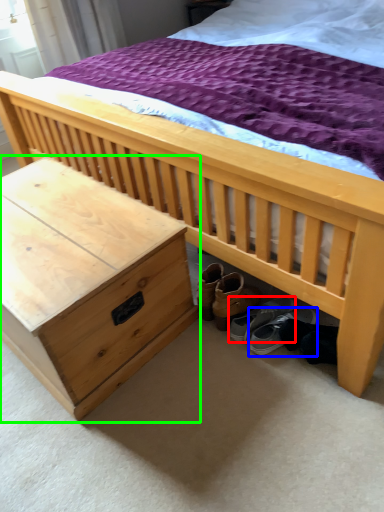
Question: Which is farther away from footwear (highlighted by a red box)? footwear (highlighted by a blue box) or nightstand (highlighted by a green box)?

Choices:
 (A) footwear
 (B) nightstand

Answer: (B)